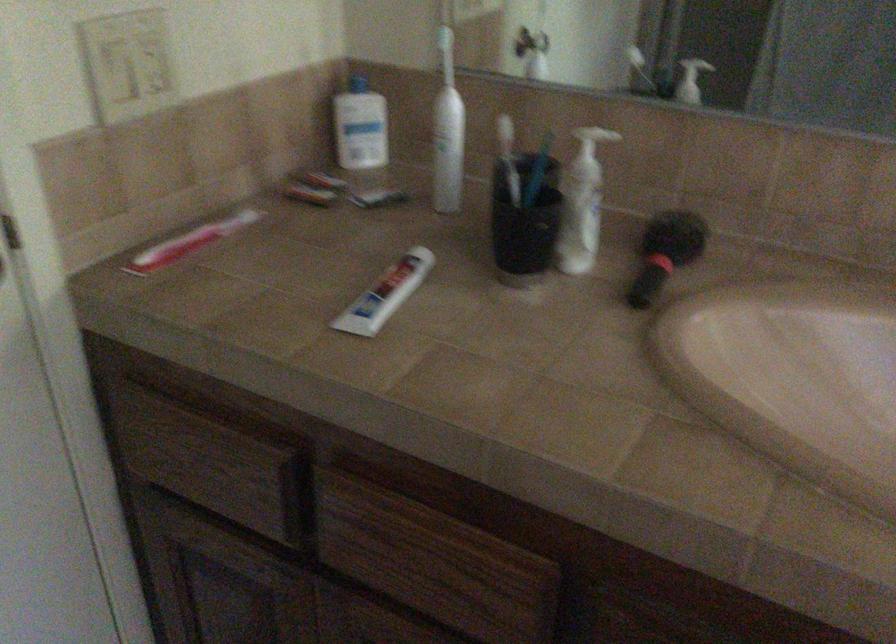
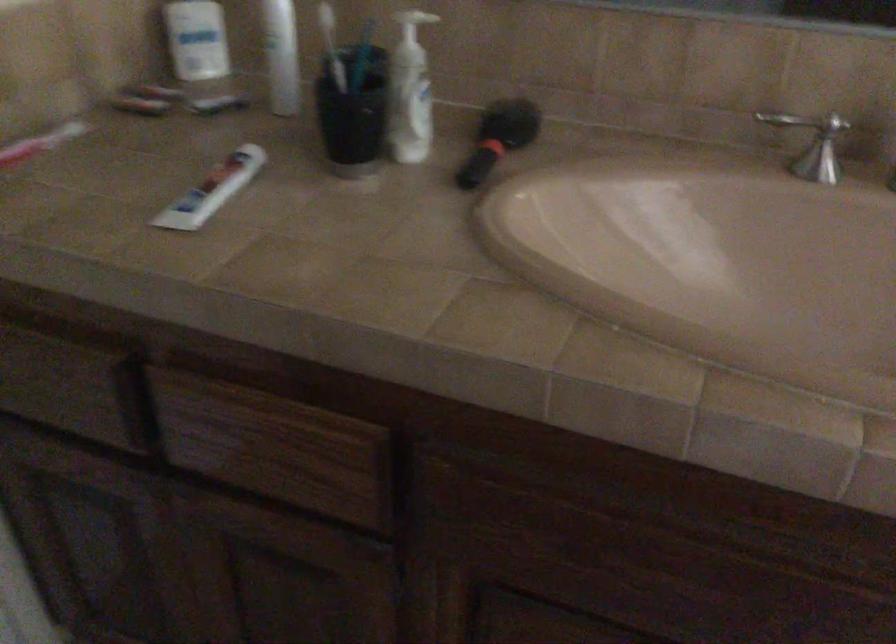
Where in the second image is the point corresponding to (x=668, y=249) from the first image?

(498, 138)